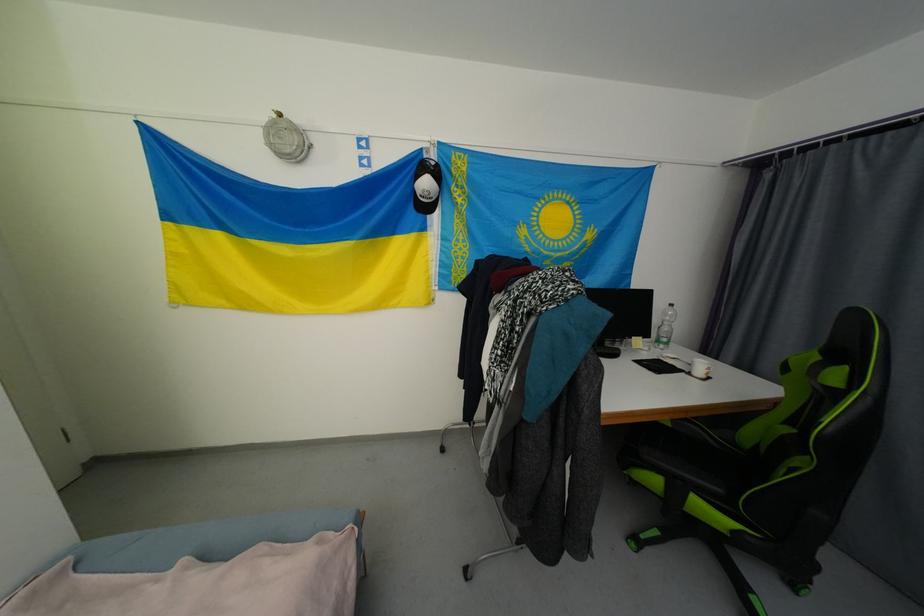
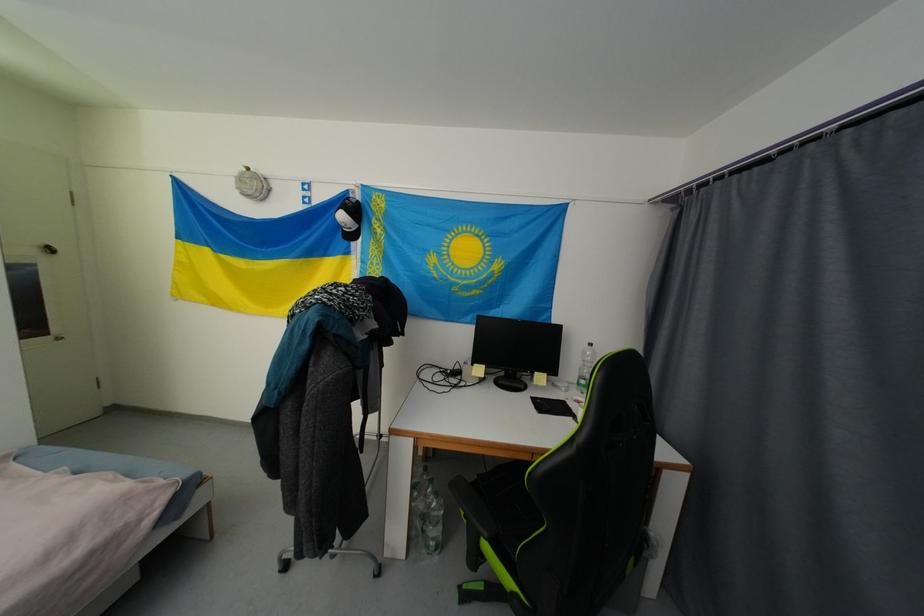
Where in the second image is the point corresponding to the point at 642,344 from the first image?

(545, 379)